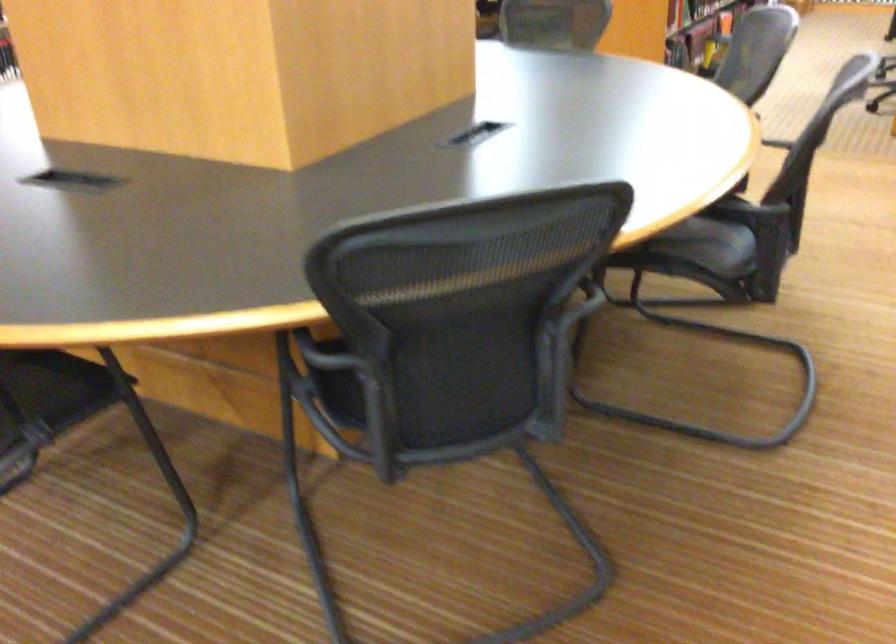
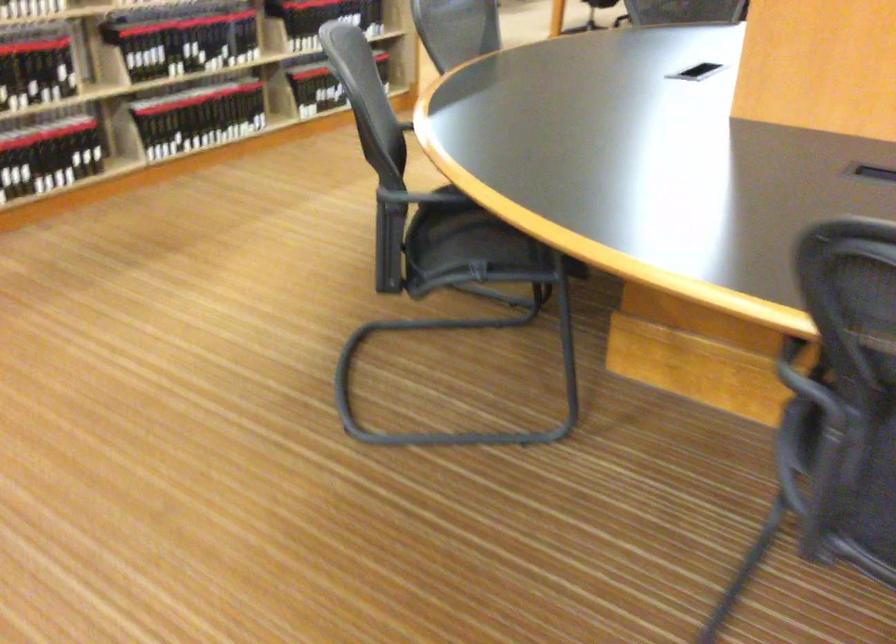
Question: What movement of the cameraman would produce the second image?

Choices:
 (A) Left
 (B) Right
 (C) Forward
 (D) Backward

Answer: (A)